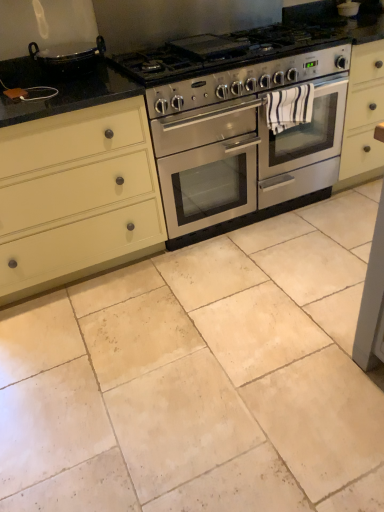
Question: Is beige stone tile at center oriented away from black granite countertop at center?

Choices:
 (A) yes
 (B) no

Answer: (B)

Question: Considering the relative sizes of beige stone tile at center and black granite countertop at center in the image provided, is beige stone tile at center shorter than black granite countertop at center?

Choices:
 (A) yes
 (B) no

Answer: (A)

Question: Is beige stone tile at center oriented towards black granite countertop at center?

Choices:
 (A) no
 (B) yes

Answer: (A)

Question: Does beige stone tile at center come behind black granite countertop at center?

Choices:
 (A) no
 (B) yes

Answer: (A)

Question: Can you confirm if beige stone tile at center is wider than black granite countertop at center?

Choices:
 (A) no
 (B) yes

Answer: (B)

Question: Can you confirm if beige stone tile at center is positioned to the right of black granite countertop at center?

Choices:
 (A) no
 (B) yes

Answer: (B)

Question: Is stainless steel oven at center completely or partially inside beige stone tile at center?

Choices:
 (A) no
 (B) yes

Answer: (A)

Question: Can you confirm if beige stone tile at center is thinner than stainless steel oven at center?

Choices:
 (A) yes
 (B) no

Answer: (B)

Question: From the image's perspective, does beige stone tile at center appear higher than stainless steel oven at center?

Choices:
 (A) yes
 (B) no

Answer: (B)

Question: Considering the relative sizes of beige stone tile at center and stainless steel oven at center in the image provided, is beige stone tile at center bigger than stainless steel oven at center?

Choices:
 (A) no
 (B) yes

Answer: (A)

Question: Does beige stone tile at center have a lesser height compared to stainless steel oven at center?

Choices:
 (A) yes
 (B) no

Answer: (A)

Question: Is beige stone tile at center outside stainless steel oven at center?

Choices:
 (A) yes
 (B) no

Answer: (A)

Question: Does white striped towel at center appear on the right side of matte cream cabinet at left?

Choices:
 (A) yes
 (B) no

Answer: (A)